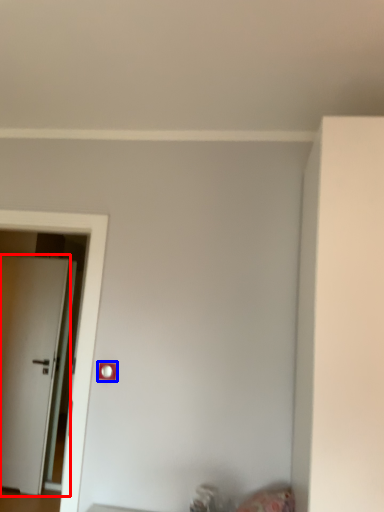
Question: Which object appears closest to the camera in this image, door (highlighted by a red box) or light switch (highlighted by a blue box)?

Choices:
 (A) door
 (B) light switch

Answer: (B)